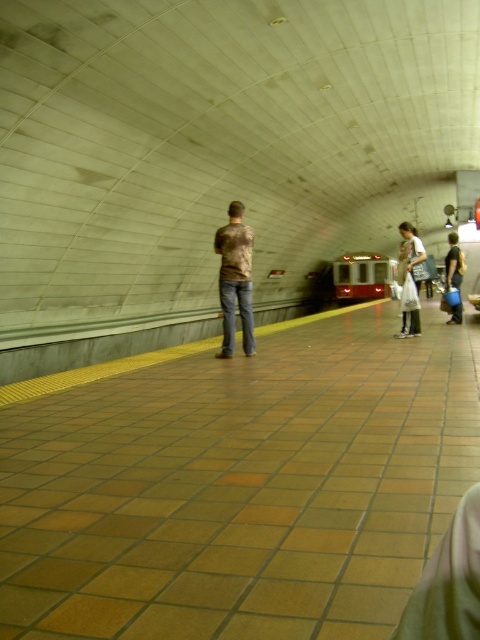
Measure the distance between brown textured shirt at center and camera.

brown textured shirt at center is 6.93 meters away from camera.

Can you confirm if brown textured shirt at center is smaller than white cotton shirt at center?

No, brown textured shirt at center is not smaller than white cotton shirt at center.

Does point (250, 259) lie behind point (412, 276)?

That is False.

Find the location of `brown textured shirt at center`. brown textured shirt at center is located at coordinates (235, 280).

Is white cotton shirt at center positioned behind denim pants at right?

No, it is not.

Based on the photo, is white cotton shirt at center shorter than denim pants at right?

Yes, white cotton shirt at center is shorter than denim pants at right.

Which is in front, point (403, 264) or point (462, 269)?

Positioned in front is point (403, 264).

Identify the location of white cotton shirt at center. The height and width of the screenshot is (640, 480). (409, 253).

Is red metallic subway train at center thinner than denim pants at right?

In fact, red metallic subway train at center might be wider than denim pants at right.

The width and height of the screenshot is (480, 640). What are the coordinates of `red metallic subway train at center` in the screenshot? It's located at (362, 276).